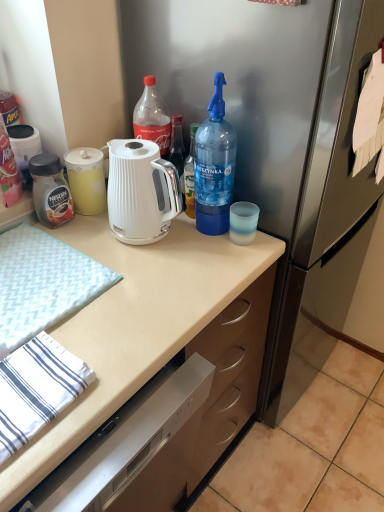
Question: Is the position of matte black jar at left, which is the 1th bottle from left to right, more distant than that of white textured hand towel at left?

Choices:
 (A) yes
 (B) no

Answer: (A)

Question: Is matte black jar at left, arranged as the third bottle when viewed from the right, completely or partially outside of white textured hand towel at left?

Choices:
 (A) yes
 (B) no

Answer: (A)

Question: Would you say white textured hand towel at left is part of matte black jar at left, arranged as the third bottle when viewed from the right,'s contents?

Choices:
 (A) no
 (B) yes

Answer: (A)

Question: Is matte black jar at left, arranged as the third bottle when viewed from the right, smaller than white textured hand towel at left?

Choices:
 (A) no
 (B) yes

Answer: (B)

Question: From a real-world perspective, is matte black jar at left, arranged as the third bottle when viewed from the right, physically above white textured hand towel at left?

Choices:
 (A) no
 (B) yes

Answer: (B)

Question: In the image, is blue translucent bottle at right, the 1th bottle when ordered from right to left, positioned in front of or behind white glossy electric kettle at center?

Choices:
 (A) front
 (B) behind

Answer: (A)

Question: In terms of height, does blue translucent bottle at right, the 1th bottle when ordered from right to left, look taller or shorter compared to white glossy electric kettle at center?

Choices:
 (A) tall
 (B) short

Answer: (A)

Question: Do you think blue translucent bottle at right, the third bottle in the left-to-right sequence, is within white glossy electric kettle at center, or outside of it?

Choices:
 (A) outside
 (B) inside

Answer: (A)

Question: From a real-world perspective, is blue translucent bottle at right, the 1th bottle when ordered from right to left, above or below white glossy electric kettle at center?

Choices:
 (A) below
 (B) above

Answer: (B)

Question: Would you say white glossy electric kettle at center is to the left or to the right of white matte countertop at center in the picture?

Choices:
 (A) right
 (B) left

Answer: (A)

Question: In the image, is white glossy electric kettle at center positioned in front of or behind white matte countertop at center?

Choices:
 (A) front
 (B) behind

Answer: (B)

Question: Considering the positions of point (173, 193) and point (11, 206), is point (173, 193) closer or farther from the camera than point (11, 206)?

Choices:
 (A) closer
 (B) farther

Answer: (A)

Question: Is white glossy electric kettle at center taller or shorter than white matte countertop at center?

Choices:
 (A) short
 (B) tall

Answer: (A)

Question: Considering the positions of white textured hand towel at left and white glossy electric kettle at center in the image, is white textured hand towel at left wider or thinner than white glossy electric kettle at center?

Choices:
 (A) thin
 (B) wide

Answer: (B)

Question: Does point (18, 346) appear closer or farther from the camera than point (112, 211)?

Choices:
 (A) farther
 (B) closer

Answer: (B)